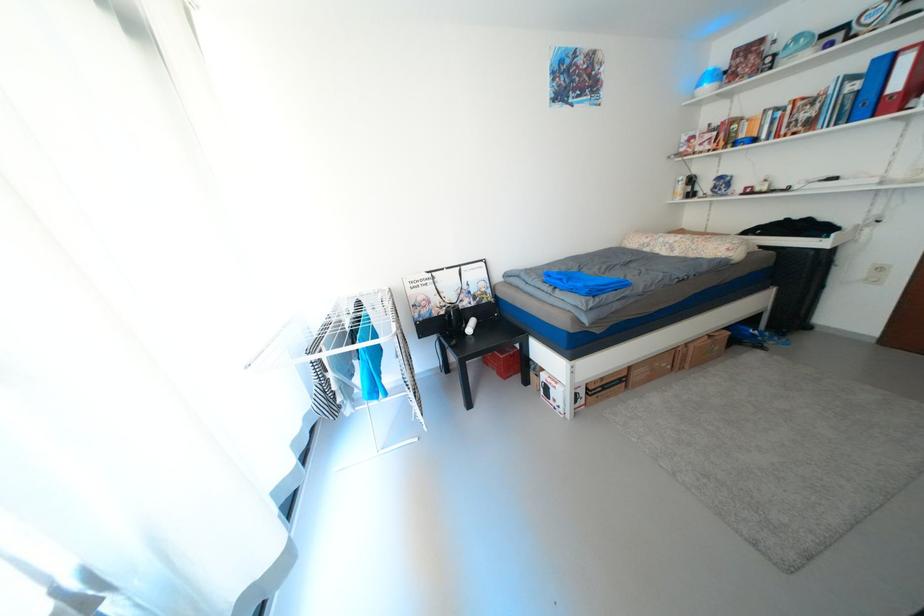
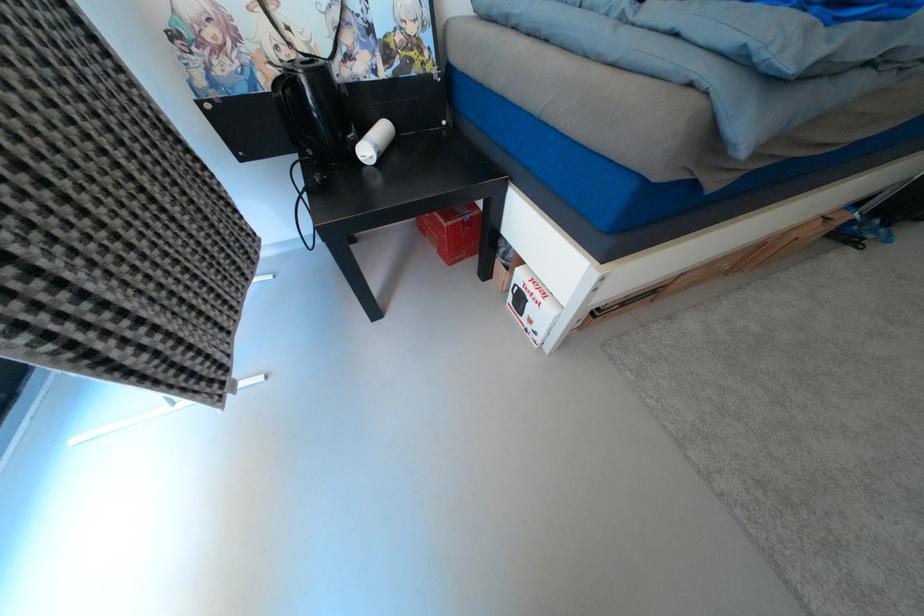
Locate, in the second image, the point that corresponds to [481,323] in the first image.

(392, 132)